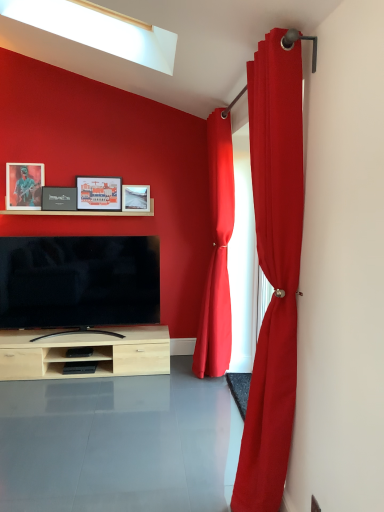
Question: From a real-world perspective, is matte black picture frame at upper left, positioned as the fourth picture frame in right-to-left order, under matte wooden picture frame at center, which is counted as the 4th picture frame, starting from the left?

Choices:
 (A) yes
 (B) no

Answer: (B)

Question: From the image's perspective, is matte black picture frame at upper left, which appears as the first picture frame when viewed from the left, over matte wooden picture frame at center, which is counted as the 4th picture frame, starting from the left?

Choices:
 (A) yes
 (B) no

Answer: (A)

Question: Does matte black picture frame at upper left, positioned as the fourth picture frame in right-to-left order, contain matte wooden picture frame at center, which is counted as the 4th picture frame, starting from the left?

Choices:
 (A) yes
 (B) no

Answer: (B)

Question: Does matte black picture frame at upper left, positioned as the fourth picture frame in right-to-left order, have a smaller size compared to matte wooden picture frame at center, the first picture frame positioned from the right?

Choices:
 (A) yes
 (B) no

Answer: (B)

Question: Does matte black picture frame at upper left, positioned as the fourth picture frame in right-to-left order, appear on the right side of matte wooden picture frame at center, which is counted as the 4th picture frame, starting from the left?

Choices:
 (A) no
 (B) yes

Answer: (A)

Question: From a real-world perspective, is matte wooden picture frame at center, which is counted as the 4th picture frame, starting from the left, physically located above or below matte black picture frame at upper left, which appears as the first picture frame when viewed from the left?

Choices:
 (A) below
 (B) above

Answer: (A)

Question: From the image's perspective, is matte wooden picture frame at center, the first picture frame positioned from the right, positioned above or below matte black picture frame at upper left, which appears as the first picture frame when viewed from the left?

Choices:
 (A) above
 (B) below

Answer: (B)

Question: In the image, is matte wooden picture frame at center, which is counted as the 4th picture frame, starting from the left, on the left side or the right side of matte black picture frame at upper left, which appears as the first picture frame when viewed from the left?

Choices:
 (A) left
 (B) right

Answer: (B)

Question: Considering their positions, is matte wooden picture frame at center, which is counted as the 4th picture frame, starting from the left, located in front of or behind matte black picture frame at upper left, which appears as the first picture frame when viewed from the left?

Choices:
 (A) front
 (B) behind

Answer: (B)

Question: From the image's perspective, is matte red curtain at right, which is counted as the 1th curtain, starting from the front, located above or below matte red curtain at right, which is the first curtain in back-to-front order?

Choices:
 (A) above
 (B) below

Answer: (B)

Question: Is matte red curtain at right, the 2th curtain viewed from the back, wider or thinner than matte red curtain at right, which is the second curtain in front-to-back order?

Choices:
 (A) wide
 (B) thin

Answer: (A)

Question: From their relative heights in the image, would you say matte red curtain at right, which is counted as the 1th curtain, starting from the front, is taller or shorter than matte red curtain at right, which is the first curtain in back-to-front order?

Choices:
 (A) short
 (B) tall

Answer: (A)

Question: Is point (261, 142) positioned closer to the camera than point (198, 331)?

Choices:
 (A) farther
 (B) closer

Answer: (B)

Question: Considering their positions, is matte red curtain at right, which is the second curtain in front-to-back order, located in front of or behind matte black picture frame at upper left, which appears as the first picture frame when viewed from the left?

Choices:
 (A) behind
 (B) front

Answer: (B)

Question: Considering the positions of matte red curtain at right, which is the first curtain in back-to-front order, and matte black picture frame at upper left, which appears as the first picture frame when viewed from the left, in the image, is matte red curtain at right, which is the first curtain in back-to-front order, bigger or smaller than matte black picture frame at upper left, which appears as the first picture frame when viewed from the left,?

Choices:
 (A) small
 (B) big

Answer: (B)